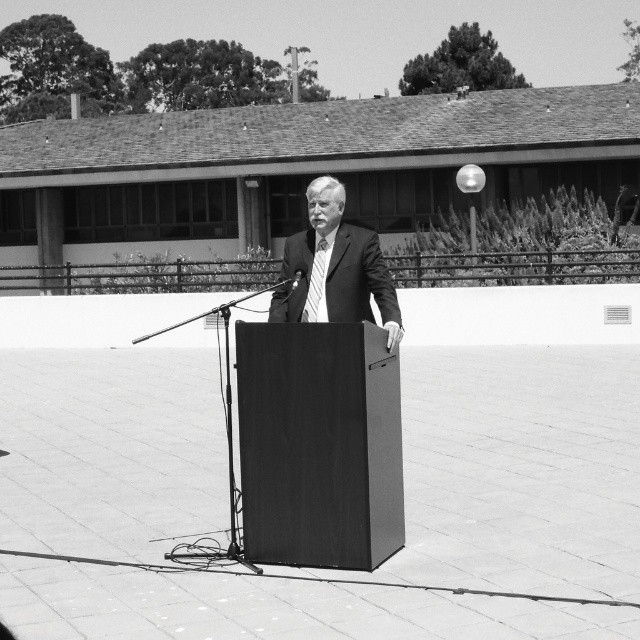
Question: Observing the image, what is the correct spatial positioning of smooth black podium at center in reference to smooth suit at center?

Choices:
 (A) below
 (B) above

Answer: (A)

Question: Is smooth black podium at center smaller than smooth suit at center?

Choices:
 (A) no
 (B) yes

Answer: (A)

Question: Which of the following is the closest to the observer?

Choices:
 (A) smooth black podium at center
 (B) smooth suit at center

Answer: (A)

Question: Can you confirm if smooth black podium at center is wider than smooth suit at center?

Choices:
 (A) yes
 (B) no

Answer: (A)

Question: Which object is farther from the camera taking this photo?

Choices:
 (A) smooth black podium at center
 (B) smooth suit at center

Answer: (B)

Question: Which of the following is the closest to the observer?

Choices:
 (A) smooth black podium at center
 (B) smooth suit at center

Answer: (A)